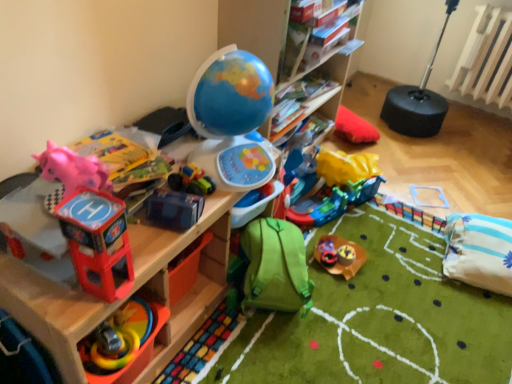
You are a GUI agent. You are given a task and a screenshot of the screen. Output one action in this format:
    pyautogui.click(x=<x>, y=<y>)
    Task: Click on the vacant location behind shiny metallic toy car at center, which ranks as the 1th toy in right-to-left order
    This screenshot has height=384, width=512.
    Given the screenshot: What is the action you would take?
    pyautogui.click(x=338, y=242)